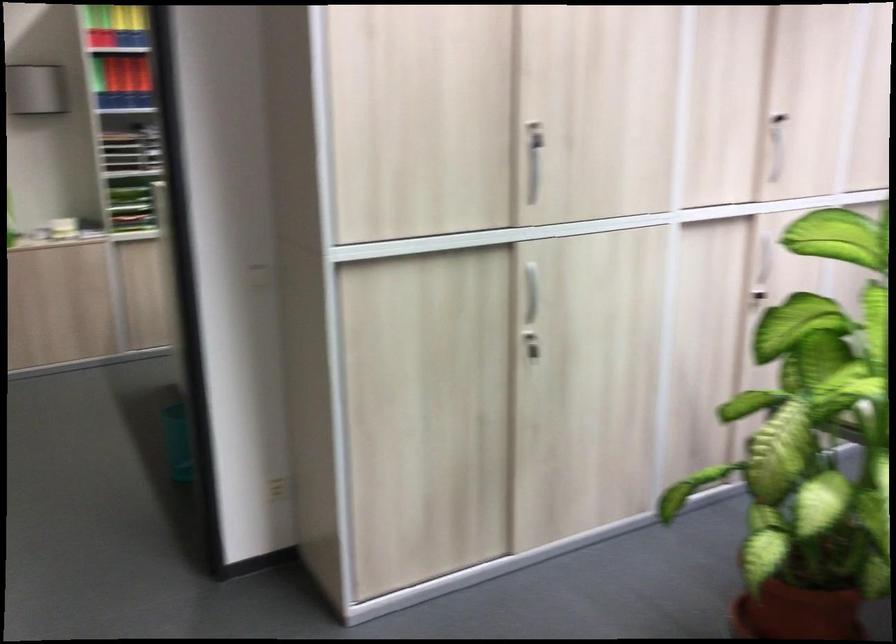
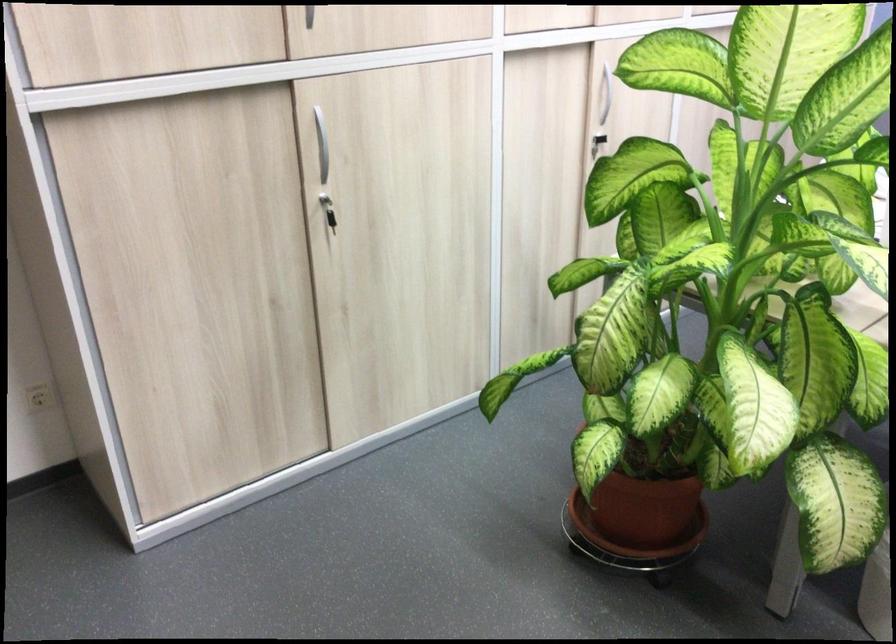
In the second image, find the point that corresponds to pixel 530 342 in the first image.

(328, 210)